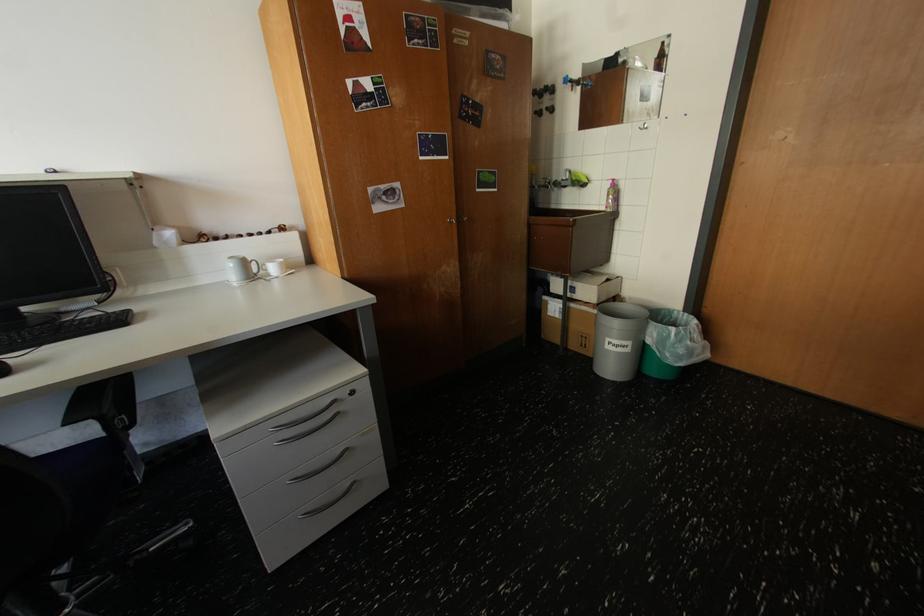
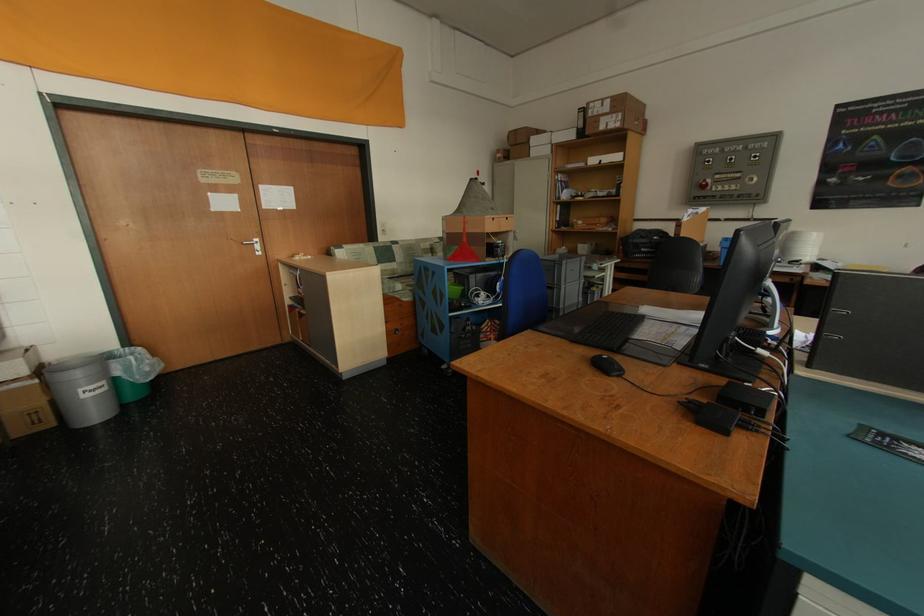
Locate, in the second image, the point that corresponds to [681,330] in the first image.

(140, 359)